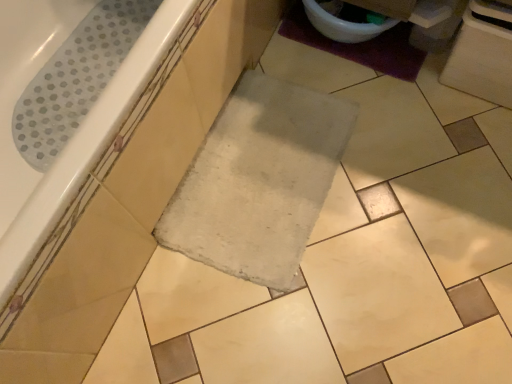
Question: Could white glossy toilet bowl at upper right be considered to be inside white glossy bathtub at upper left?

Choices:
 (A) yes
 (B) no

Answer: (B)

Question: From the image's perspective, is white glossy bathtub at upper left beneath white glossy toilet bowl at upper right?

Choices:
 (A) no
 (B) yes

Answer: (B)

Question: From the image's perspective, would you say white glossy bathtub at upper left is positioned over white glossy toilet bowl at upper right?

Choices:
 (A) yes
 (B) no

Answer: (B)

Question: Is white glossy bathtub at upper left outside of white glossy toilet bowl at upper right?

Choices:
 (A) yes
 (B) no

Answer: (A)

Question: From a real-world perspective, does white glossy bathtub at upper left stand above white glossy toilet bowl at upper right?

Choices:
 (A) no
 (B) yes

Answer: (B)

Question: In terms of width, does purple fuzzy bath mat at upper right look wider or thinner when compared to white glossy toilet bowl at upper right?

Choices:
 (A) thin
 (B) wide

Answer: (B)

Question: From a real-world perspective, is purple fuzzy bath mat at upper right physically located above or below white glossy toilet bowl at upper right?

Choices:
 (A) above
 (B) below

Answer: (B)

Question: Based on their positions, is purple fuzzy bath mat at upper right located to the left or right of white glossy toilet bowl at upper right?

Choices:
 (A) right
 (B) left

Answer: (A)

Question: Is purple fuzzy bath mat at upper right bigger or smaller than white glossy toilet bowl at upper right?

Choices:
 (A) small
 (B) big

Answer: (A)

Question: Is purple fuzzy bath mat at upper right situated inside white glossy bathtub at upper left or outside?

Choices:
 (A) outside
 (B) inside

Answer: (A)

Question: From the image's perspective, is purple fuzzy bath mat at upper right located above or below white glossy bathtub at upper left?

Choices:
 (A) above
 (B) below

Answer: (A)

Question: In terms of width, does purple fuzzy bath mat at upper right look wider or thinner when compared to white glossy bathtub at upper left?

Choices:
 (A) wide
 (B) thin

Answer: (B)

Question: In the image, is purple fuzzy bath mat at upper right on the left side or the right side of white glossy bathtub at upper left?

Choices:
 (A) right
 (B) left

Answer: (A)

Question: Does point (354, 26) appear closer or farther from the camera than point (312, 34)?

Choices:
 (A) closer
 (B) farther

Answer: (A)

Question: Is white glossy toilet bowl at upper right taller or shorter than purple fuzzy bath mat at upper right?

Choices:
 (A) short
 (B) tall

Answer: (B)